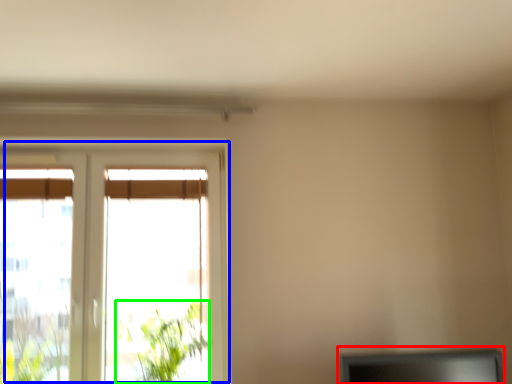
Question: Which object is positioned farthest from computer monitor (highlighted by a red box)? Select from window (highlighted by a blue box) and plant (highlighted by a green box).

Choices:
 (A) window
 (B) plant

Answer: (A)